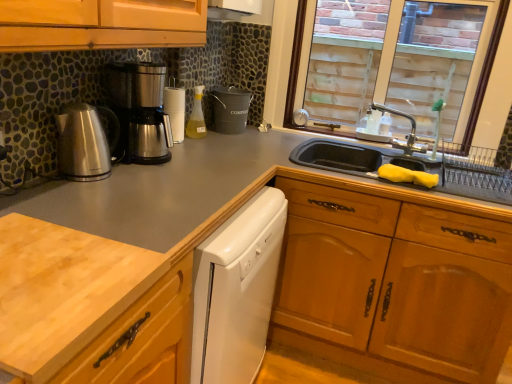
Question: In terms of width, does silver metallic faucet at upper right look wider or thinner when compared to brushed metal kettle at left, marked as the second kitchen appliance in a back-to-front arrangement?

Choices:
 (A) thin
 (B) wide

Answer: (B)

Question: From a real-world perspective, relative to brushed metal kettle at left, positioned as the 1th kitchen appliance in front-to-back order, is silver metallic faucet at upper right vertically above or below?

Choices:
 (A) above
 (B) below

Answer: (A)

Question: Estimate the real-world distances between objects in this image. Which object is closer to the silver metallic faucet at upper right?

Choices:
 (A) stainless steel coffee maker at left, acting as the first kitchen appliance starting from the back
 (B) translucent plastic bottle at center
 (C) brushed metal kettle at left, positioned as the 1th kitchen appliance in front-to-back order
 (D) light wood cutting board at lower left
 (E) wooden drawer at lower right

Answer: (E)

Question: Estimate the real-world distances between objects in this image. Which object is closer to the light wood cutting board at lower left?

Choices:
 (A) matte black bucket at center
 (B) white glossy dishwasher at center
 (C) brushed metal kettle at left, marked as the second kitchen appliance in a back-to-front arrangement
 (D) translucent plastic bottle at center
 (E) stainless steel coffee maker at left, the second kitchen appliance viewed from the front

Answer: (B)